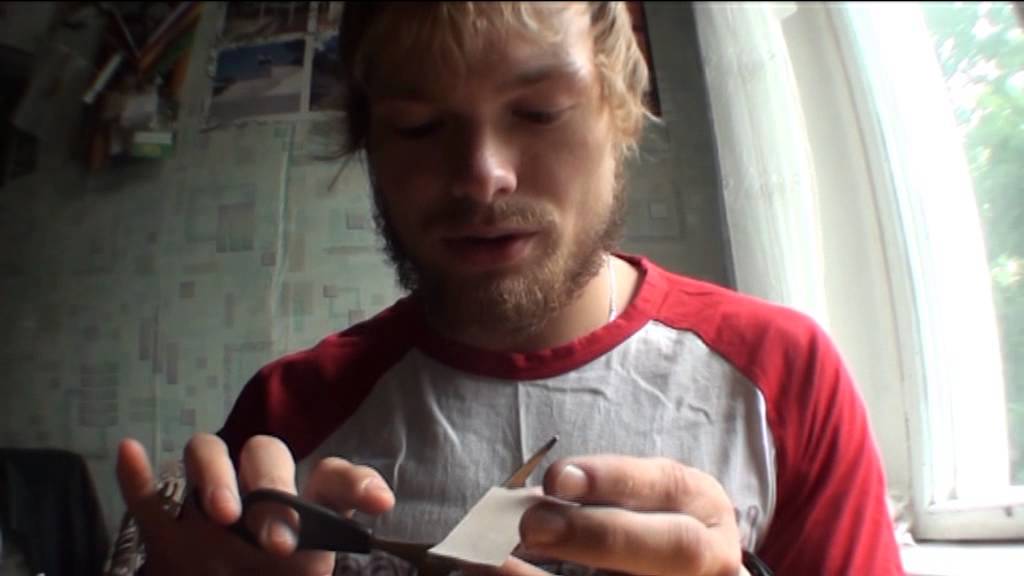
Where is `wall`? This screenshot has width=1024, height=576. wall is located at coordinates (325, 267).